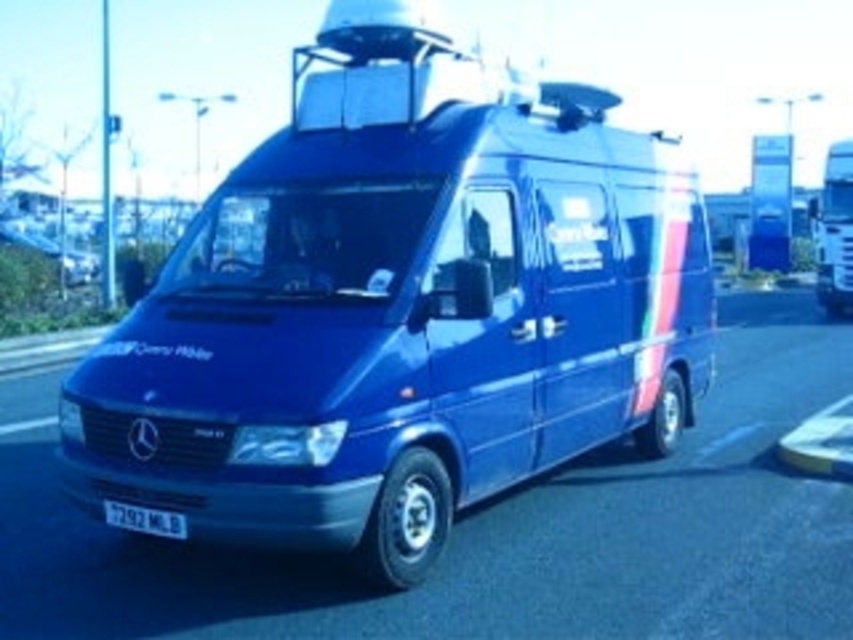
Question: Which point is closer to the camera?

Choices:
 (A) white plastic license plate at lower left
 (B) glossy blue van at center
 (C) blue metallic van at right

Answer: (A)

Question: Is metallic blue van at center wider than blue metallic van at right?

Choices:
 (A) no
 (B) yes

Answer: (B)

Question: Can you confirm if blue metallic van at right is wider than white plastic license plate at lower left?

Choices:
 (A) no
 (B) yes

Answer: (B)

Question: Can you confirm if metallic blue van at center is positioned to the right of blue metallic van at right?

Choices:
 (A) yes
 (B) no

Answer: (B)

Question: Which object is farther from the camera taking this photo?

Choices:
 (A) glossy blue van at center
 (B) white plastic license plate at lower left
 (C) metallic blue van at center
 (D) blue metallic van at right

Answer: (D)

Question: Which of the following is the closest to the observer?

Choices:
 (A) (825, 200)
 (B) (833, 522)
 (C) (593, 108)

Answer: (B)